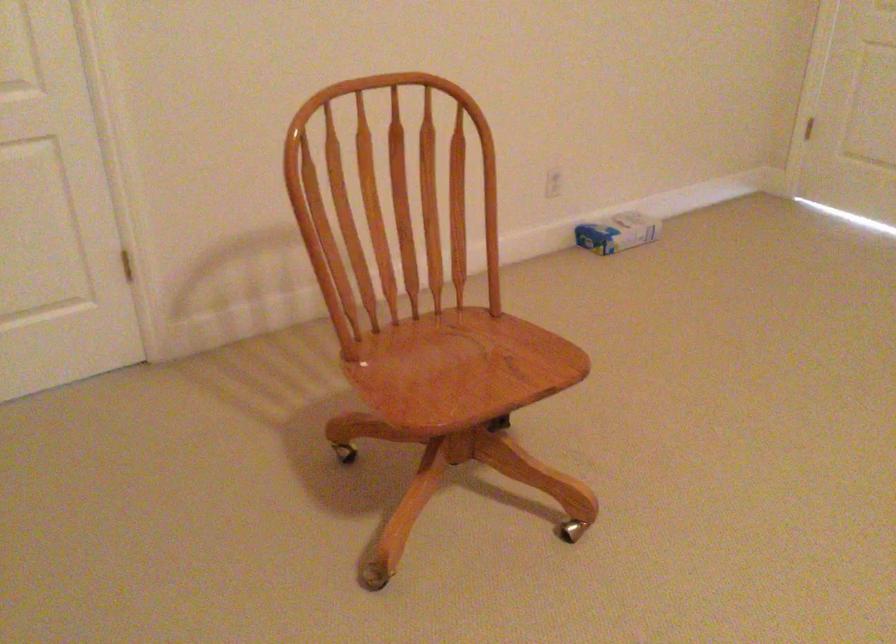
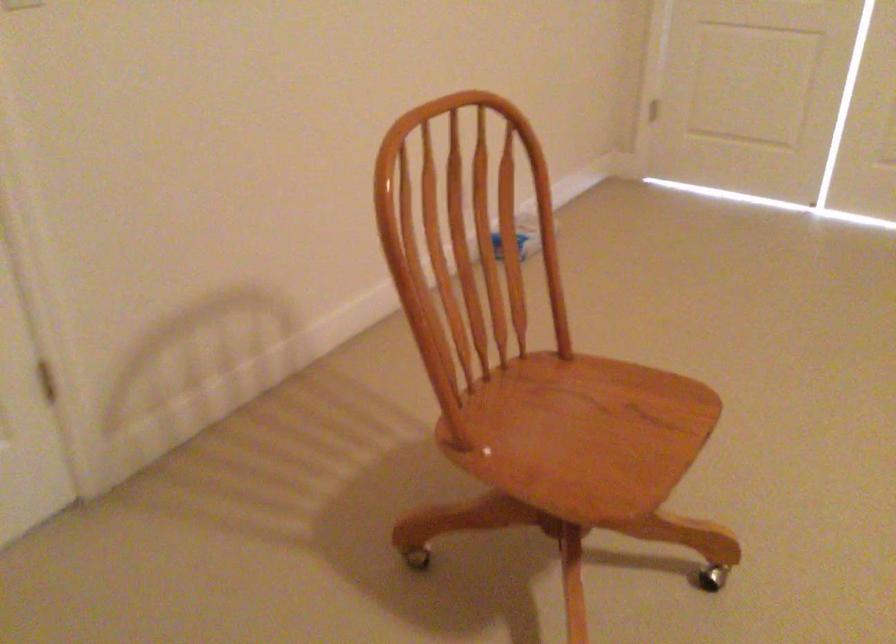
The point at [438,370] is marked in the first image. Where is the corresponding point in the second image?

(565, 436)